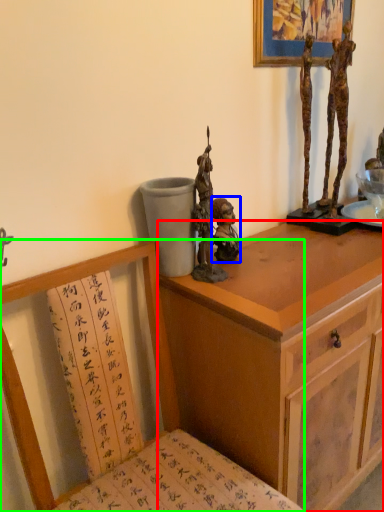
Question: Which is nearer to the cabinetry (highlighted by a red box)? person (highlighted by a blue box) or chair (highlighted by a green box).

Choices:
 (A) person
 (B) chair

Answer: (B)